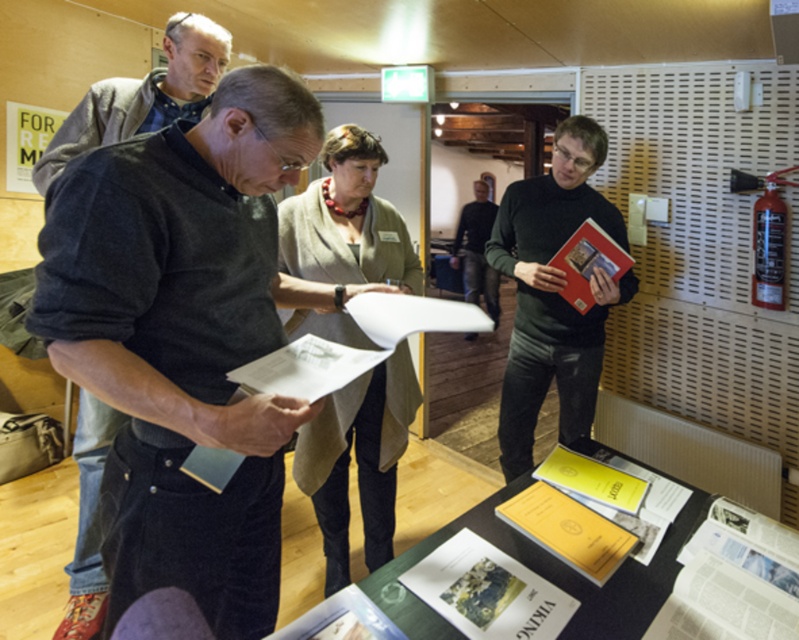
Question: Does paper-covered table at center have a lesser width compared to white paper at center?

Choices:
 (A) no
 (B) yes

Answer: (A)

Question: Does beige woolen coat at center lie in front of dark gray sweater at center?

Choices:
 (A) no
 (B) yes

Answer: (B)

Question: Which is farther from the dark gray sweater at upper left?

Choices:
 (A) white paper at center
 (B) beige woolen coat at center
 (C) metallic perforated board at right

Answer: (C)

Question: Which of the following is the closest to the observer?

Choices:
 (A) (738, 221)
 (B) (479, 179)

Answer: (A)

Question: Does paper-covered table at center appear over white paper at center?

Choices:
 (A) yes
 (B) no

Answer: (A)

Question: Considering the real-world distances, which object is farthest from the beige woolen coat at center?

Choices:
 (A) metallic perforated board at right
 (B) dark gray sweater at center
 (C) white paper at center
 (D) paper-covered table at center

Answer: (B)